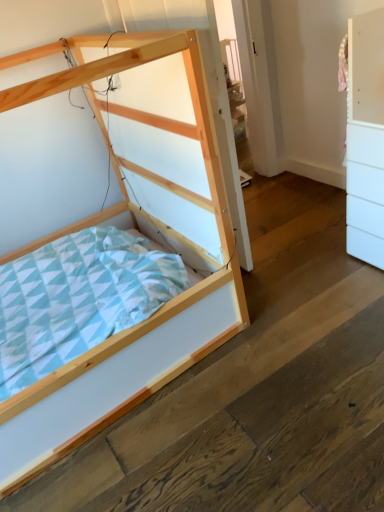
Where is `spots to the right of natural wood bed at left`? This screenshot has height=512, width=384. spots to the right of natural wood bed at left is located at coordinates (295, 298).